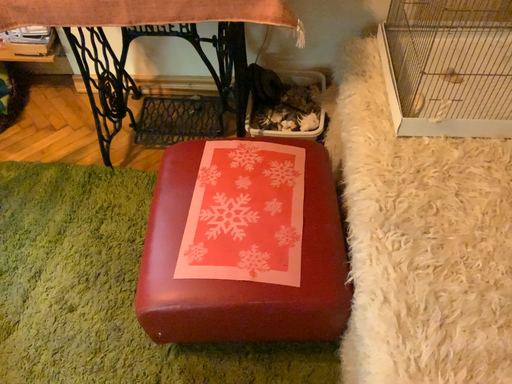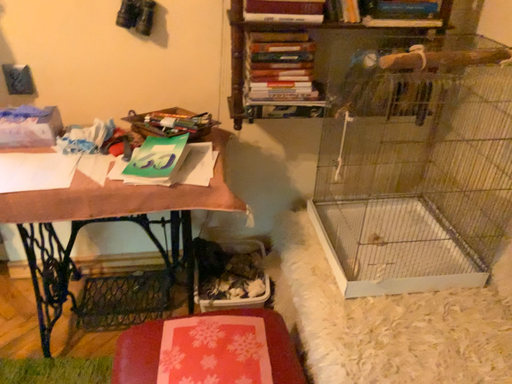
Question: Which way did the camera rotate in the video?

Choices:
 (A) rotated left
 (B) rotated right

Answer: (B)